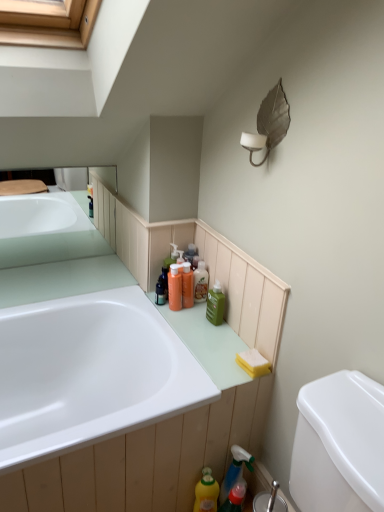
You are a GUI agent. You are given a task and a screenshot of the screen. Output one action in this format:
    pyautogui.click(x=<x>, y=<y>)
    Task: Click on the vacant area situated to the left side of green matte bottle at upper right, placed as the 1th cleaning product when sorted from top to bottom
    This screenshot has width=384, height=512.
    Given the screenshot: What is the action you would take?
    pyautogui.click(x=182, y=317)